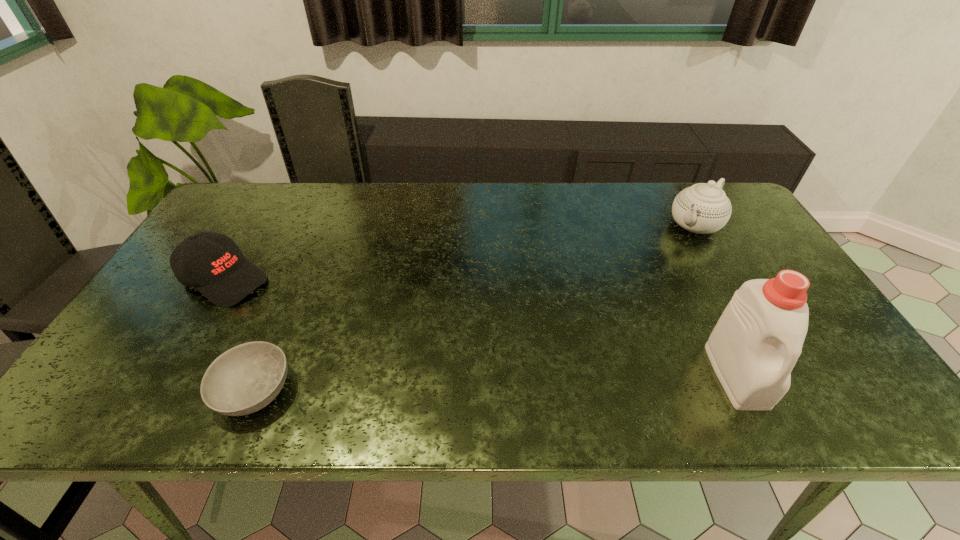
Identify the location of free space located on the front-facing side of the leftmost object. (276, 302).

This screenshot has width=960, height=540. Identify the location of free spot located 0.140m on the front-facing side of the leftmost object. (296, 313).

Where is `free space located 0.270m on the front-facing side of the leftmost object`? This screenshot has width=960, height=540. free space located 0.270m on the front-facing side of the leftmost object is located at coordinates (335, 333).

Where is `object at the far edge`? This screenshot has width=960, height=540. object at the far edge is located at coordinates (703, 208).

Image resolution: width=960 pixels, height=540 pixels. I want to click on bowl that is at the near edge, so click(x=246, y=378).

The image size is (960, 540). In order to click on detergent that is at the near edge in this screenshot , I will do `click(753, 348)`.

At what (x,y) coordinates should I click in order to perform the action: click on object situated at the left edge. Please return your answer as a coordinate pair (x, y). The width and height of the screenshot is (960, 540). Looking at the image, I should click on (212, 263).

At what (x,y) coordinates should I click in order to perform the action: click on object that is positioned at the right edge. Please return your answer as a coordinate pair (x, y). Looking at the image, I should click on (703, 208).

This screenshot has width=960, height=540. In order to click on object that is at the far right corner in this screenshot , I will do `click(703, 208)`.

In order to click on free space at the far edge in this screenshot , I will do `click(467, 192)`.